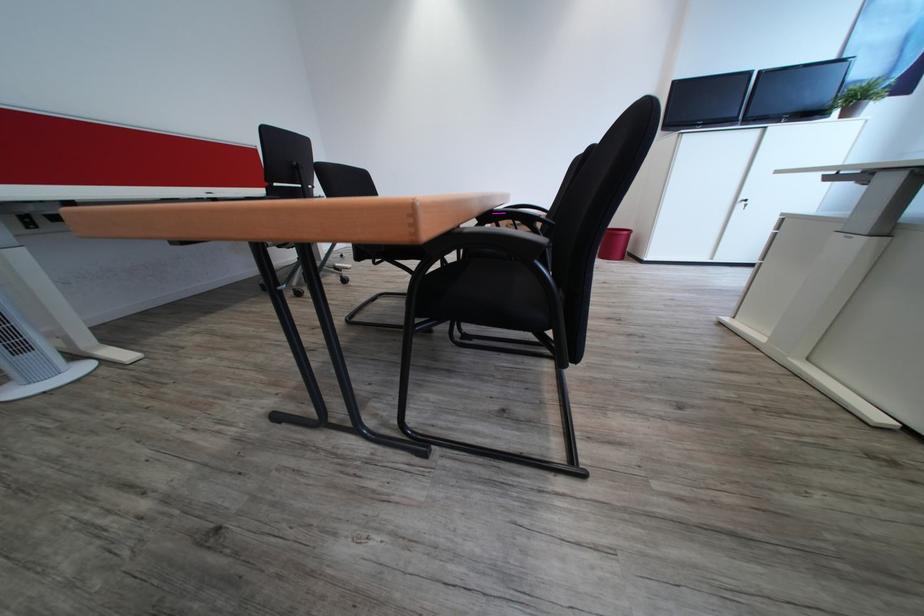
At what (x,y) coordinates should I click in order to perform the action: click on red trash can. Please return your answer as a coordinate pair (x, y). The height and width of the screenshot is (616, 924). Looking at the image, I should click on (614, 244).